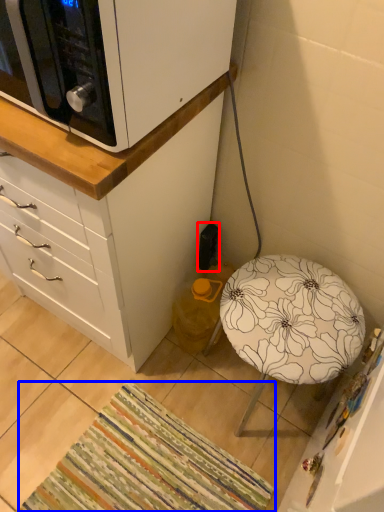
Question: Which point is further to the camera, electric outlet (highlighted by a red box) or mat (highlighted by a blue box)?

Choices:
 (A) electric outlet
 (B) mat

Answer: (A)